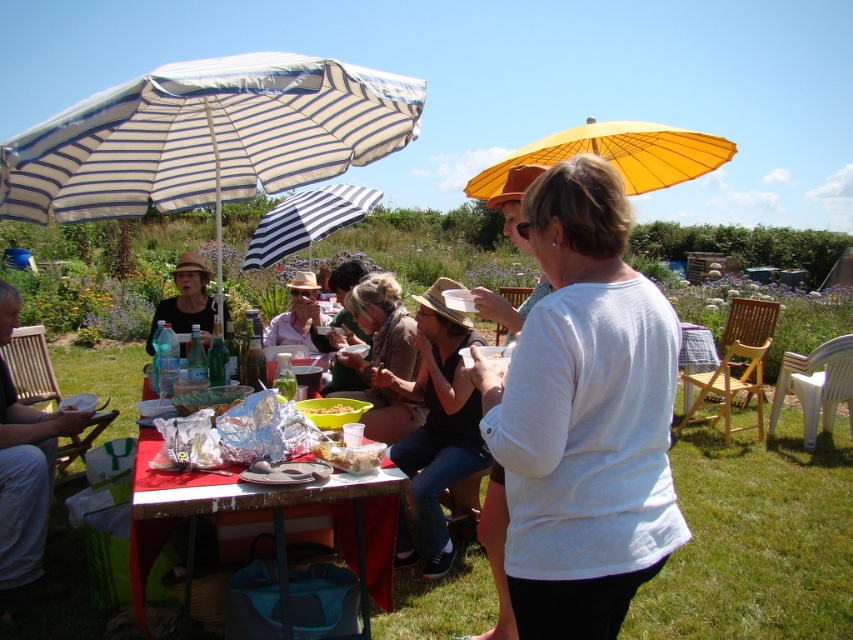
Question: Does blonde hair at center appear on the right side of matte beige hat at center?

Choices:
 (A) no
 (B) yes

Answer: (B)

Question: Among these points, which one is nearest to the camera?

Choices:
 (A) (347, 406)
 (B) (161, 320)
 (C) (430, 492)
 (D) (316, 221)

Answer: (A)

Question: Can you confirm if striped fabric umbrella at center is positioned to the right of matte beige hat at center?

Choices:
 (A) yes
 (B) no

Answer: (A)

Question: Which of the following is the farthest from the observer?

Choices:
 (A) (497, 182)
 (B) (306, 97)
 (C) (389, 346)
 (D) (308, 410)

Answer: (C)

Question: Which of the following is the farthest from the observer?

Choices:
 (A) yellow paper parasol at upper center
 (B) white matte shirt at center
 (C) white striped fabric umbrella at upper left

Answer: (C)

Question: Is the position of metallic foil table at center more distant than that of matte straw hat at center?

Choices:
 (A) yes
 (B) no

Answer: (B)